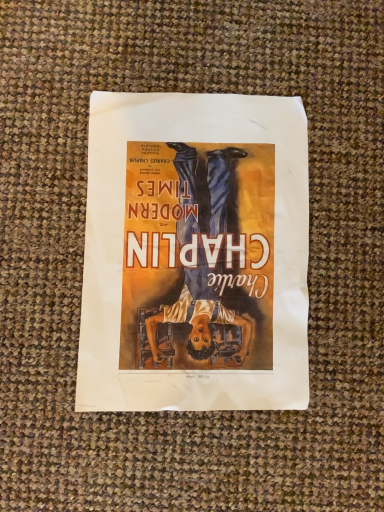
Locate an element on the screen. Image resolution: width=384 pixels, height=512 pixels. matte paper poster at center is located at coordinates (195, 254).

Describe the element at coordinates (195, 254) in the screenshot. I see `matte paper poster at center` at that location.

Identify the location of matte paper poster at center. (195, 254).